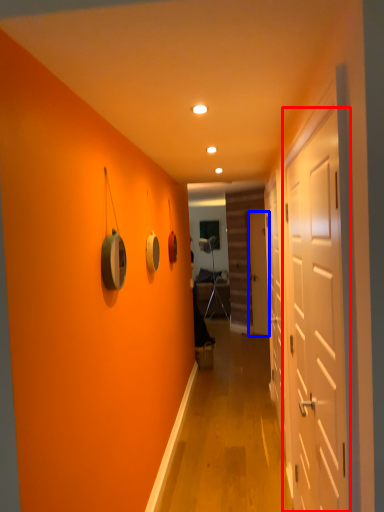
Question: Which object is closer to the camera taking this photo, door (highlighted by a red box) or door (highlighted by a blue box)?

Choices:
 (A) door
 (B) door

Answer: (A)